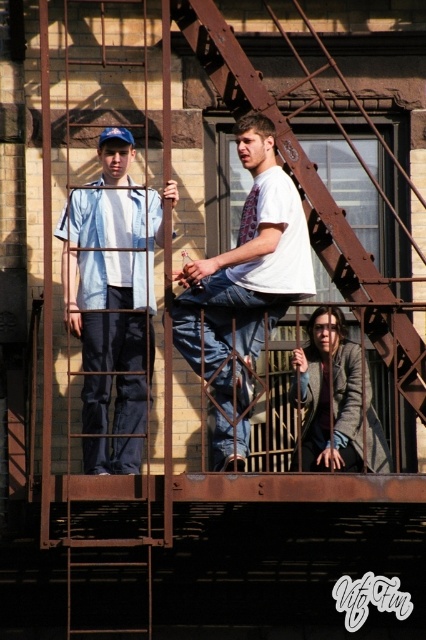
Which is more to the left, denim shirt at left or white cotton shirt at center?

denim shirt at left is more to the left.

Is point (149, 378) positioned before point (207, 300)?

That is True.

The height and width of the screenshot is (640, 426). Describe the element at coordinates (112, 300) in the screenshot. I see `denim shirt at left` at that location.

Identify the location of denim shirt at left. This screenshot has height=640, width=426. (112, 300).

Which is more to the left, denim shirt at left or rusty metal fire escape at center?

Positioned to the left is denim shirt at left.

In the scene shown: Is denim shirt at left smaller than rusty metal fire escape at center?

Correct, denim shirt at left occupies less space than rusty metal fire escape at center.

Does point (104, 317) come farther from viewer compared to point (310, 193)?

Yes, it is behind point (310, 193).

Where is `denim shirt at left`? Image resolution: width=426 pixels, height=640 pixels. denim shirt at left is located at coordinates 112,300.

Does white cotton shirt at center have a lesser width compared to rusty metal fire escape at center?

Indeed, white cotton shirt at center has a lesser width compared to rusty metal fire escape at center.

Between point (238, 451) and point (253, 109), which one is positioned in front?

Point (238, 451) is in front.

Locate an element on the screen. Image resolution: width=426 pixels, height=640 pixels. white cotton shirt at center is located at coordinates (244, 289).